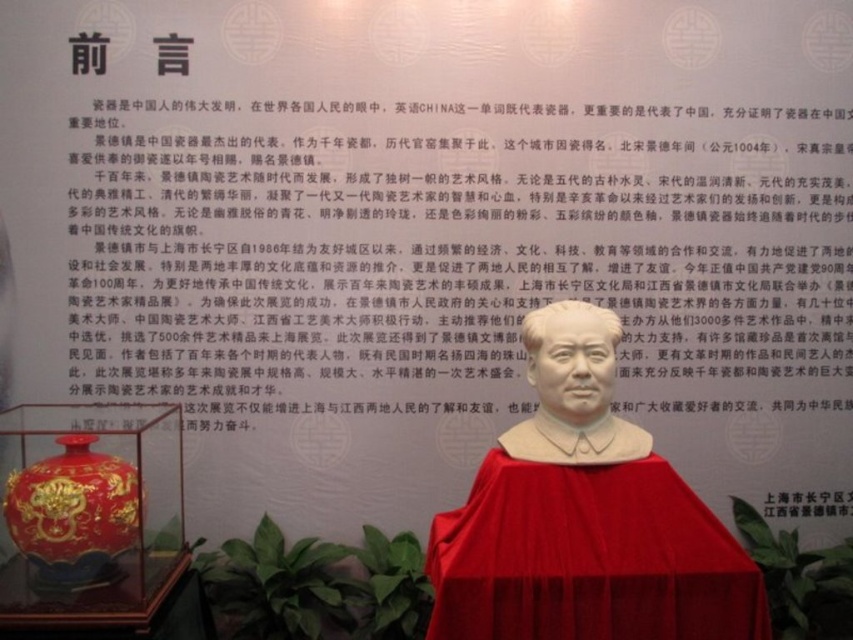
Is point (527, 497) farther from viewer compared to point (549, 356)?

No, it is not.

I want to click on white glossy statue at center, so click(584, 518).

This screenshot has width=853, height=640. What are the coordinates of `white glossy statue at center` in the screenshot? It's located at (584, 518).